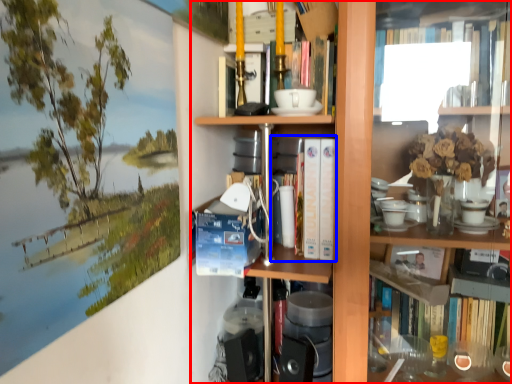
Question: Which object is further to the camera taking this photo, bookcase (highlighted by a red box) or book (highlighted by a blue box)?

Choices:
 (A) bookcase
 (B) book

Answer: (B)